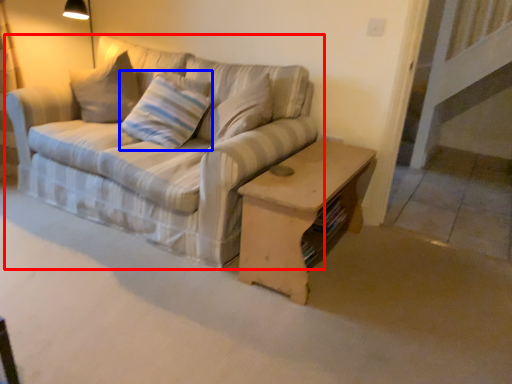
Question: Which object is closer to the camera taking this photo, studio couch (highlighted by a red box) or pillow (highlighted by a blue box)?

Choices:
 (A) studio couch
 (B) pillow

Answer: (A)